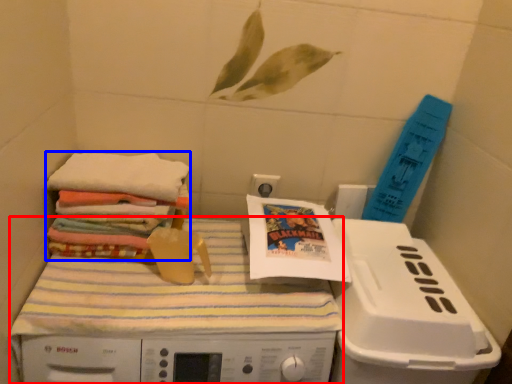
Question: Which object is closer to the camera taking this photo, machine (highlighted by a red box) or material (highlighted by a blue box)?

Choices:
 (A) machine
 (B) material

Answer: (A)